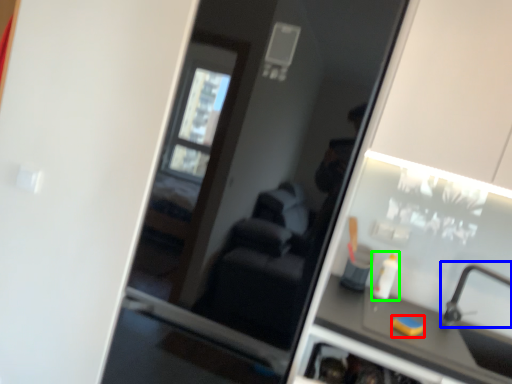
Question: Estimate the real-world distances between objects in this image. Which object is farther from soap (highlighted by a red box), faucet (highlighted by a blue box) or toiletry (highlighted by a green box)?

Choices:
 (A) faucet
 (B) toiletry

Answer: (A)